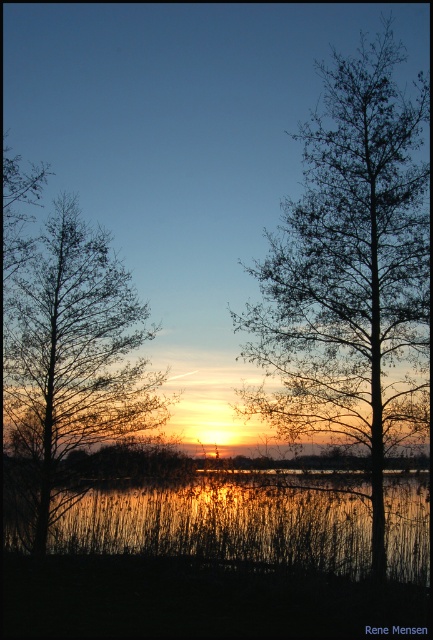
Does bare branches at center come behind reflective glass water at center?

No, bare branches at center is closer to the viewer.

Is point (329, 312) positioned in front of point (403, 522)?

No, (329, 312) is behind (403, 522).

Image resolution: width=433 pixels, height=640 pixels. I want to click on bare branches at center, so click(351, 269).

Does silhouette bare tree at left appear on the right side of reflective glass water at center?

Incorrect, silhouette bare tree at left is not on the right side of reflective glass water at center.

The width and height of the screenshot is (433, 640). Find the location of `silhouette bare tree at left`. silhouette bare tree at left is located at coordinates (70, 369).

Is bare branches at center above silhouette bare tree at left?

No, bare branches at center is not above silhouette bare tree at left.

Based on the photo, which is above, bare branches at center or silhouette bare tree at left?

silhouette bare tree at left is higher up.

Locate an element on the screen. This screenshot has height=640, width=433. bare branches at center is located at coordinates (351, 269).